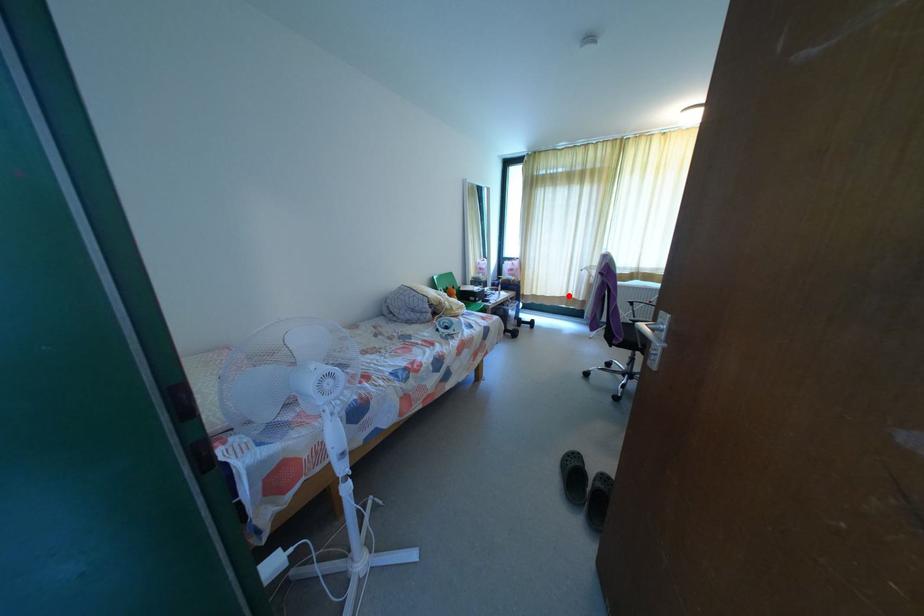
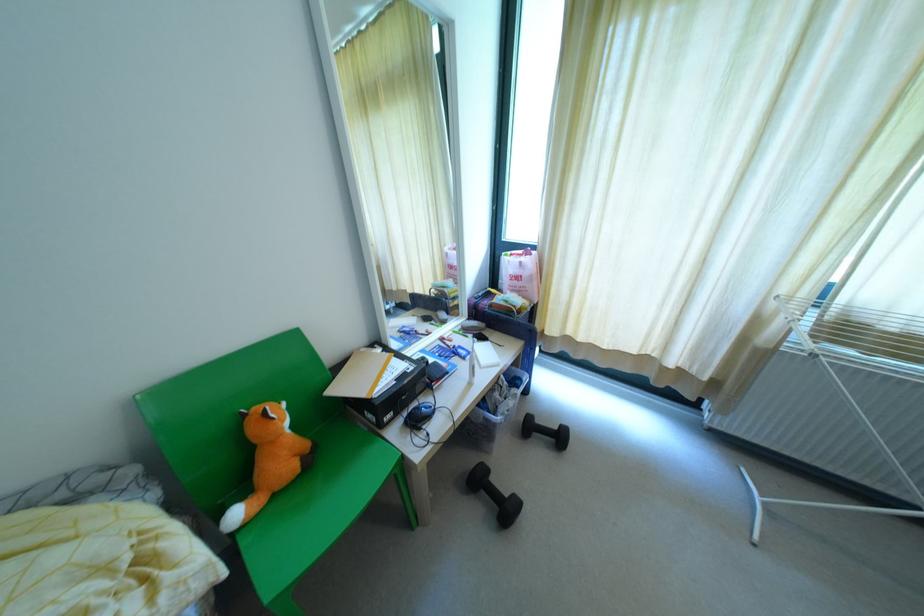
Question: I am providing you with two images of the same scene from different viewpoints. A red point is marked on the first image. At the location where the point appears in image 1, is it still visible in image 2?

Choices:
 (A) Yes
 (B) No

Answer: (A)